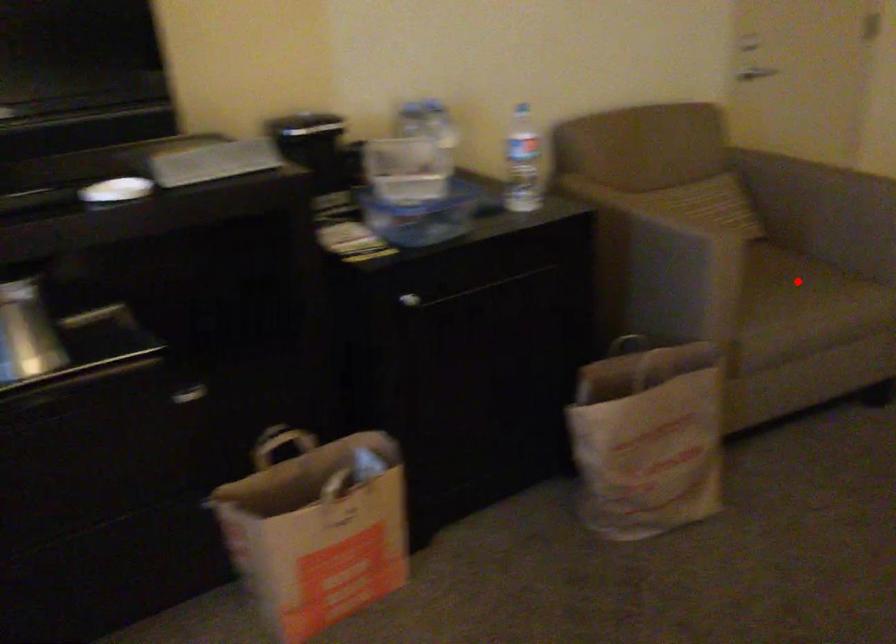
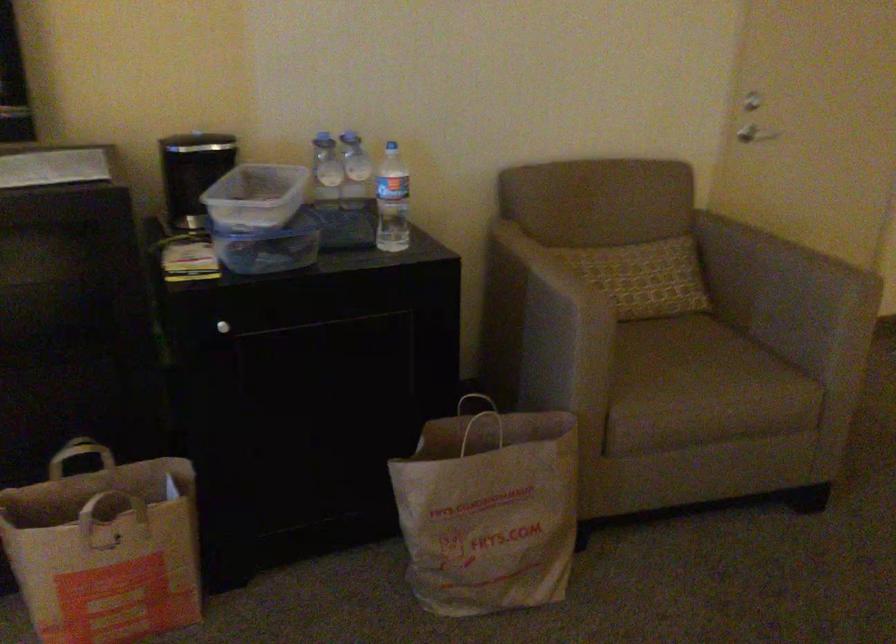
Find the pixel in the second image that matches the highlighted location in the first image.

(707, 366)